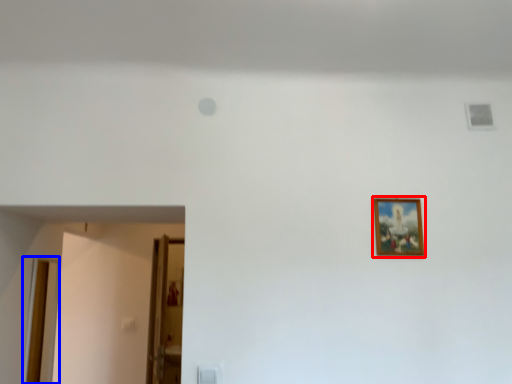
Question: Among these objects, which one is farthest to the camera, picture frame (highlighted by a red box) or door (highlighted by a blue box)?

Choices:
 (A) picture frame
 (B) door

Answer: (B)